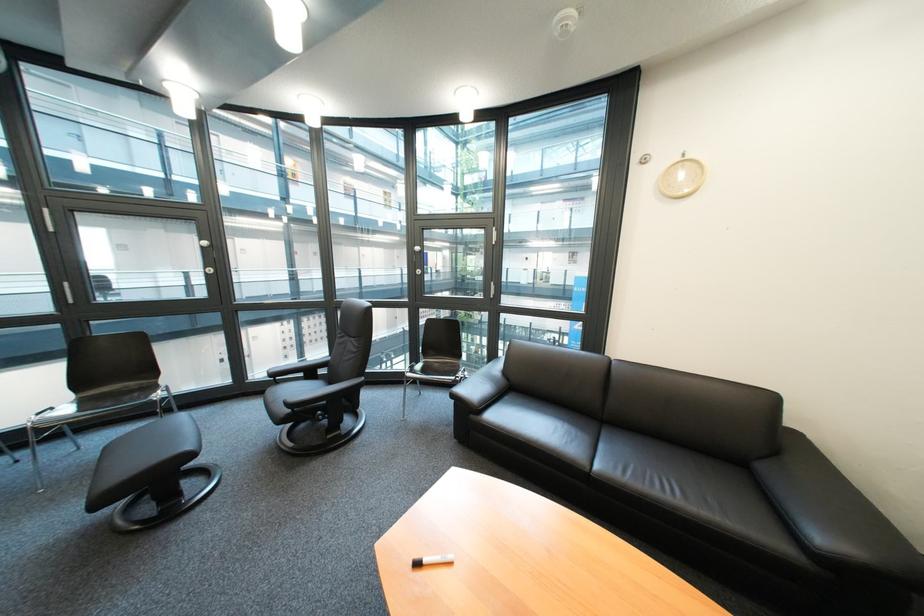
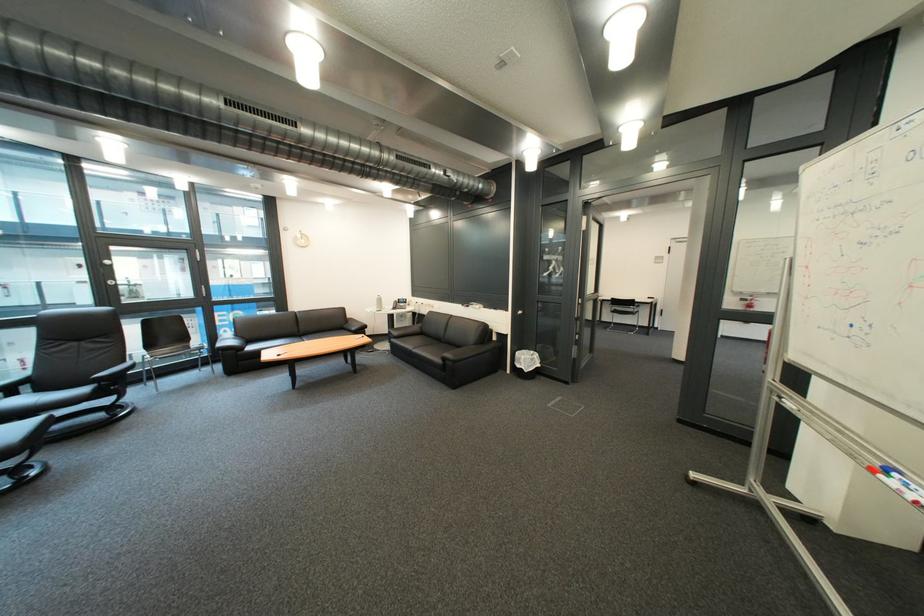
Where in the second image is the point corresponding to (x=467, y=379) from the first image?

(220, 347)